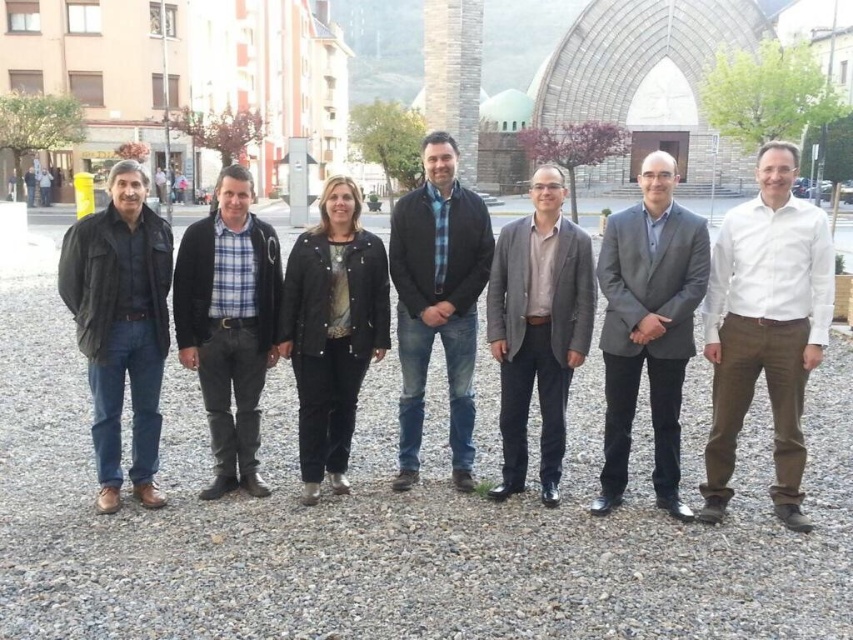
In the scene shown: Between black leather jacket at left and black leather jacket at center, which one is positioned higher?

black leather jacket at left

Does point (137, 230) come closer to viewer compared to point (302, 360)?

Yes, point (137, 230) is closer to viewer.

Who is more forward, (73, 221) or (311, 464)?

Positioned in front is point (311, 464).

Locate an element on the screen. black leather jacket at left is located at coordinates (120, 324).

Can you confirm if gray suit at center is positioned above blue plaid shirt at center?

Incorrect, gray suit at center is not positioned above blue plaid shirt at center.

Find the location of a particular element. Image resolution: width=853 pixels, height=640 pixels. gray suit at center is located at coordinates (648, 326).

Can you confirm if gray matte blazer at center is positioned below black leather jacket at center?

No, gray matte blazer at center is not below black leather jacket at center.

Is gray matte blazer at center above black leather jacket at center?

Correct, gray matte blazer at center is located above black leather jacket at center.

Does point (527, 234) come in front of point (340, 448)?

No, it is not.

The image size is (853, 640). I want to click on gray matte blazer at center, so click(538, 328).